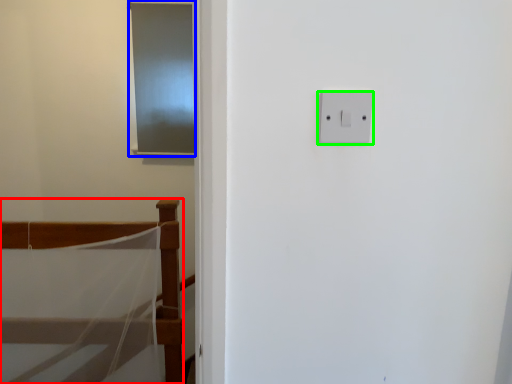
Question: Which object is the closest to the furniture (highlighted by a red box)? Choose among these: screen door (highlighted by a blue box) or light switch (highlighted by a green box).

Choices:
 (A) screen door
 (B) light switch

Answer: (A)